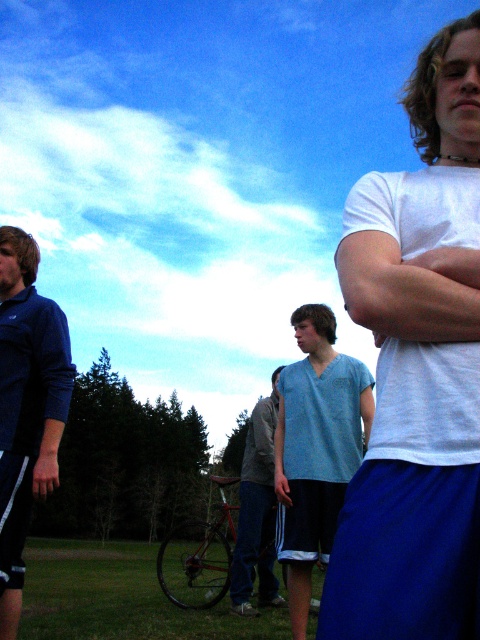
Is point (429, 593) more distant than point (277, 497)?

No, it is in front of (277, 497).

Does white matte t-shirt at right have a lesser width compared to light blue fabric at center?

No, white matte t-shirt at right is not thinner than light blue fabric at center.

Describe the element at coordinates (417, 372) in the screenshot. I see `white matte t-shirt at right` at that location.

Find the location of a particular element. This screenshot has width=480, height=640. white matte t-shirt at right is located at coordinates click(417, 372).

Is light blue cotton shirt at center to the right of light blue fabric at center from the viewer's perspective?

Incorrect, light blue cotton shirt at center is not on the right side of light blue fabric at center.

Based on the photo, does light blue cotton shirt at center appear over light blue fabric at center?

Incorrect, light blue cotton shirt at center is not positioned above light blue fabric at center.

Between point (268, 579) and point (279, 460), which one is positioned behind?

The point (268, 579) is behind.

Find the location of a particular element. light blue cotton shirt at center is located at coordinates (256, 509).

Does light blue fabric shirt at center have a greater width compared to light blue cotton shirt at center?

Yes, light blue fabric shirt at center is wider than light blue cotton shirt at center.

Based on the photo, who is positioned more to the right, light blue fabric shirt at center or light blue cotton shirt at center?

light blue fabric shirt at center

What do you see at coordinates (315, 449) in the screenshot? I see `light blue fabric shirt at center` at bounding box center [315, 449].

This screenshot has height=640, width=480. In order to click on light blue fabric shirt at center in this screenshot , I will do `click(315, 449)`.